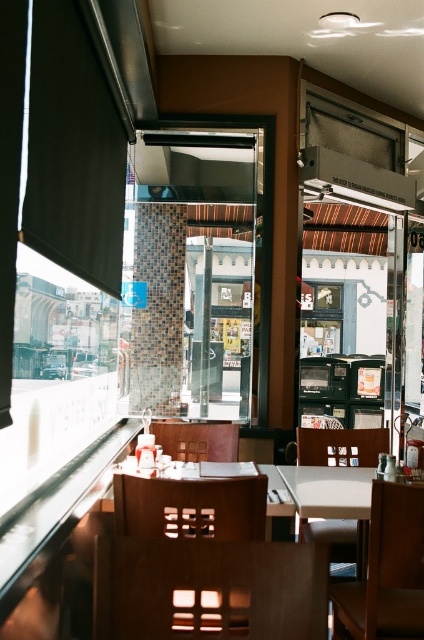
You are a customer entering the restaurant and want to choose a seat. You prefer a chair that is wider for comfort. Which chair between the wooden chair at lower center and the white plastic chair at center should you choose?

The white plastic chair at center has a greater width compared to the wooden chair at lower center, so you should choose the white plastic chair at center for a wider seat.

You are standing inside the restaurant and want to walk towards the two points marked on the window. Which of the two points, point (x=178, y=582) or point (x=343, y=465), is closer to you when you look through the window?

Point (x=178, y=582) is closer to you because it is in front of point (x=343, y=465).

You are a customer entering the restaurant and see the wooden chair at lower center and the brown leather chair at lower right. Which chair is closer to the entrance? Please explain based on their positions.

The wooden chair at lower center is above the brown leather chair at lower right, so the brown leather chair at lower right is closer to the entrance because it is positioned lower in the image, which typically corresponds to being nearer to the viewer.